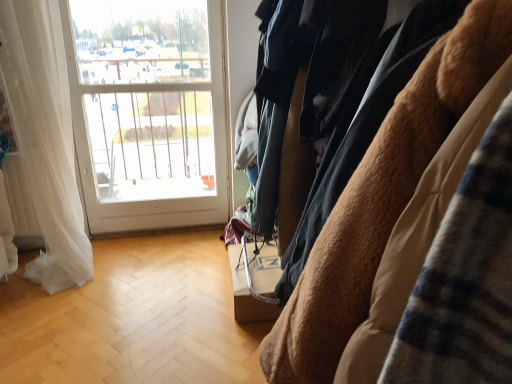
Where is `vacant space underneath white glass window at upper left (from a real-world perspective)`? vacant space underneath white glass window at upper left (from a real-world perspective) is located at coordinates (160, 230).